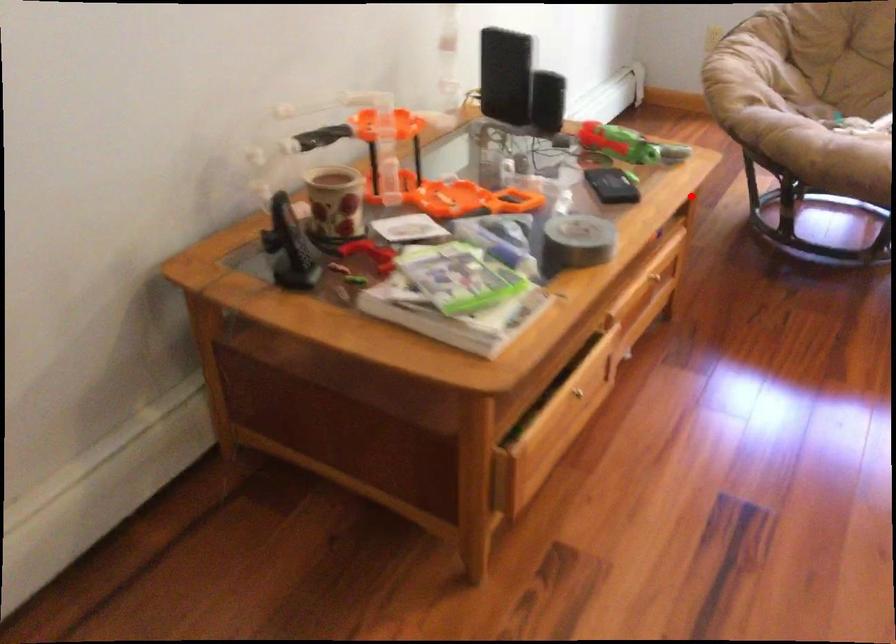
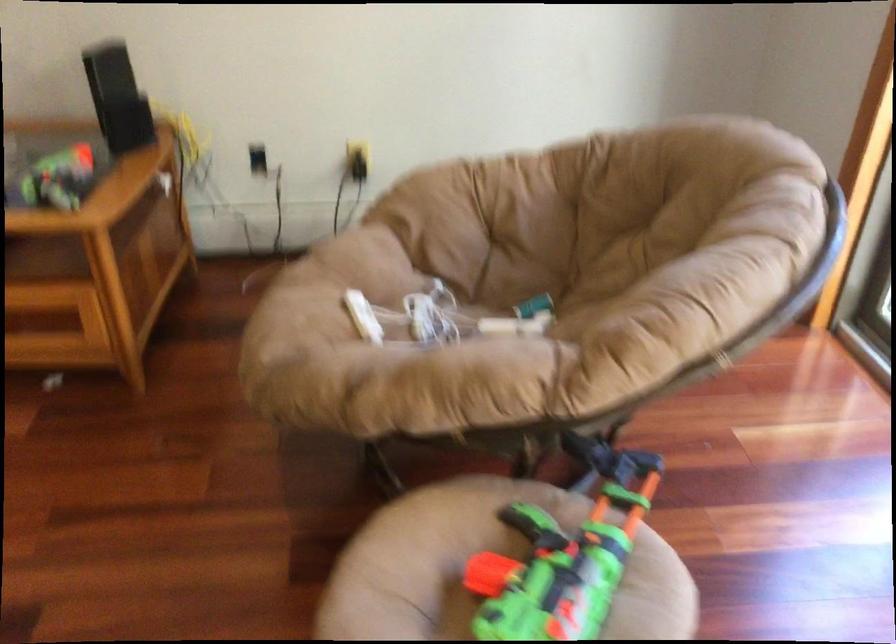
Locate, in the second image, the point that corresponds to the highlighted location in the first image.

(95, 263)